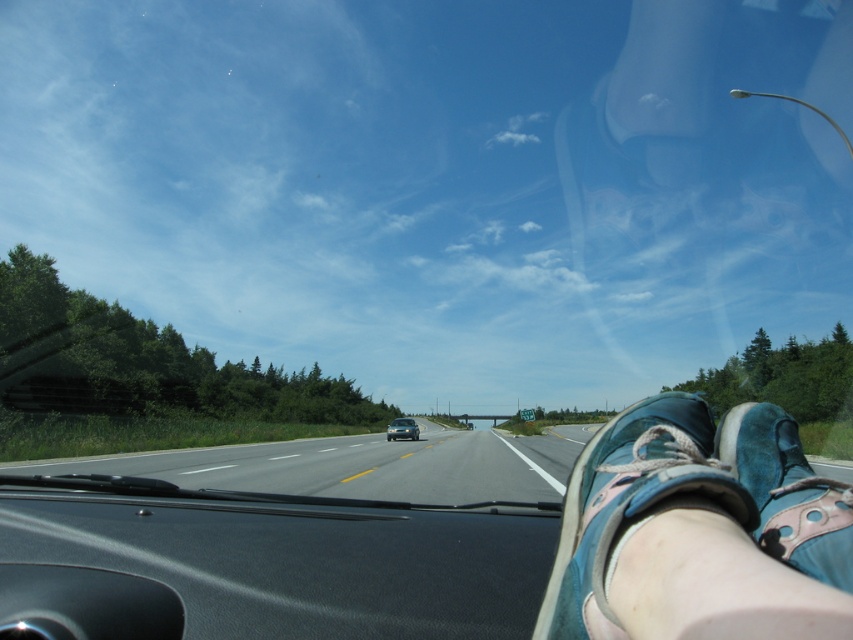
You are driving a car and want to check if there is enough space between your car and the road ahead. You notice the asphalt road at center and the blue suede shoe at lower right. Which object is closer to you?

The blue suede shoe at lower right is closer to you than the asphalt road at center.

You are driving a car and see the point marked at coordinates (x=361, y=465). Based on the scene description, what does this point most likely represent?

The point at coordinates (x=361, y=465) indicates asphalt road at center, so it most likely represents the center of the road ahead.